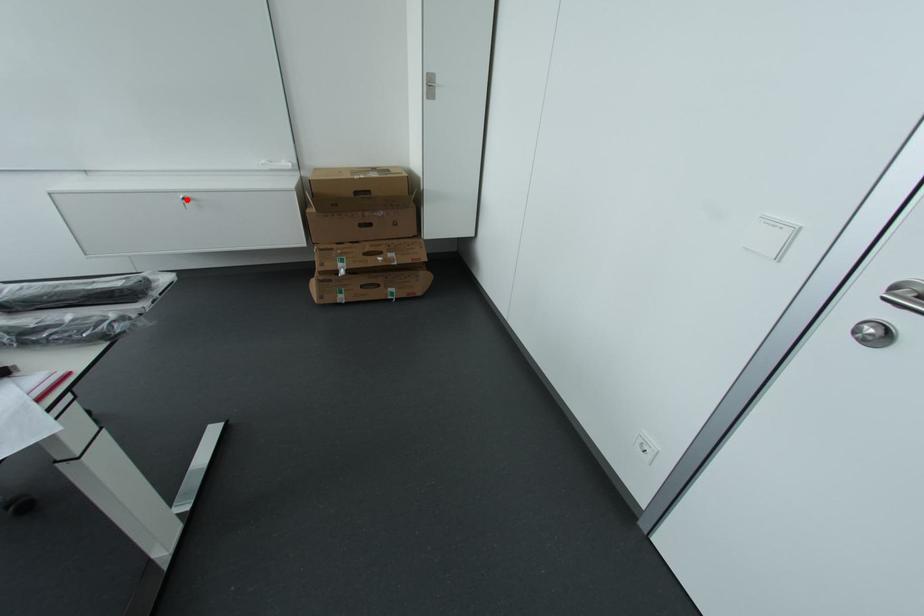
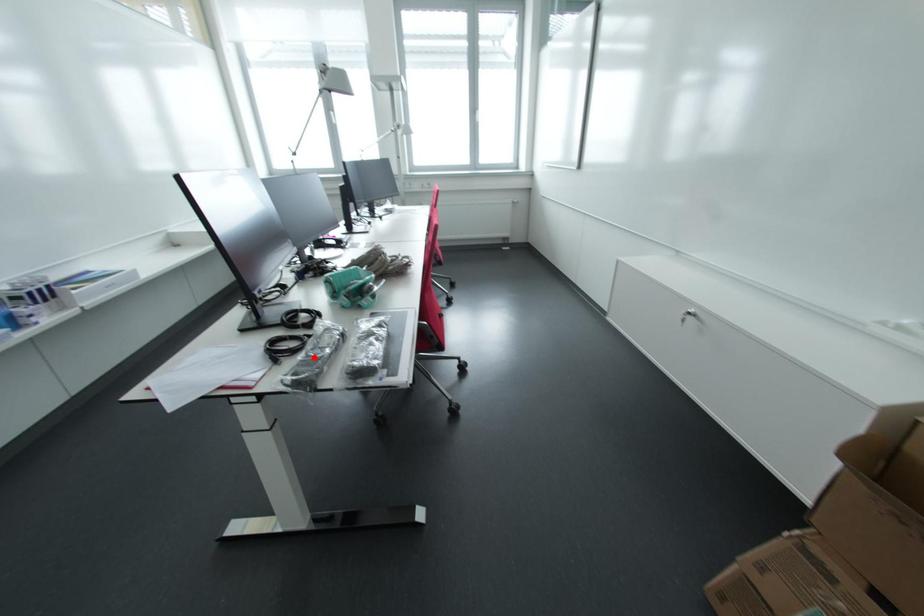
I am providing you with two images of the same scene from different viewpoints. A red point is marked on the first image and another point is marked on the second image. Is the marked point in image1 the same physical position as the marked point in image2?

No